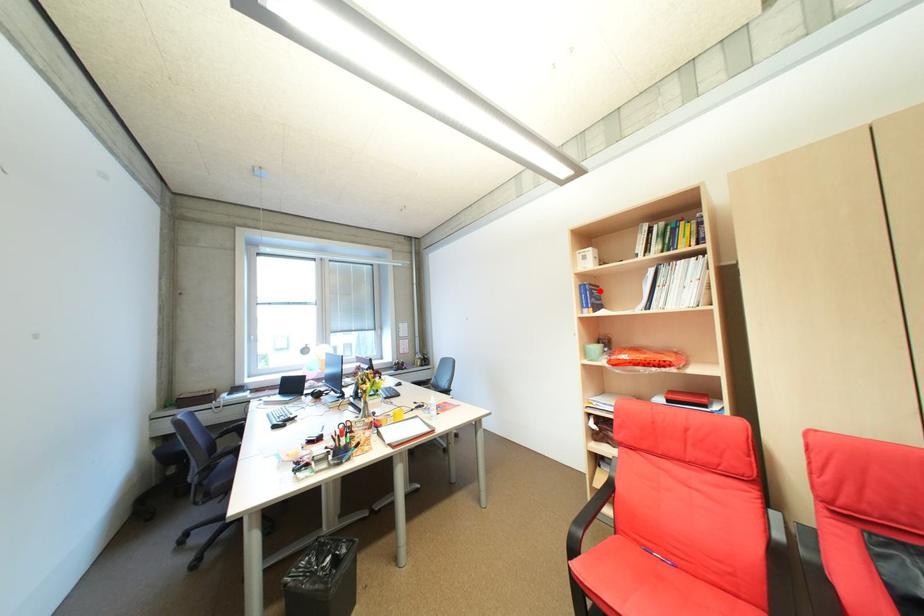
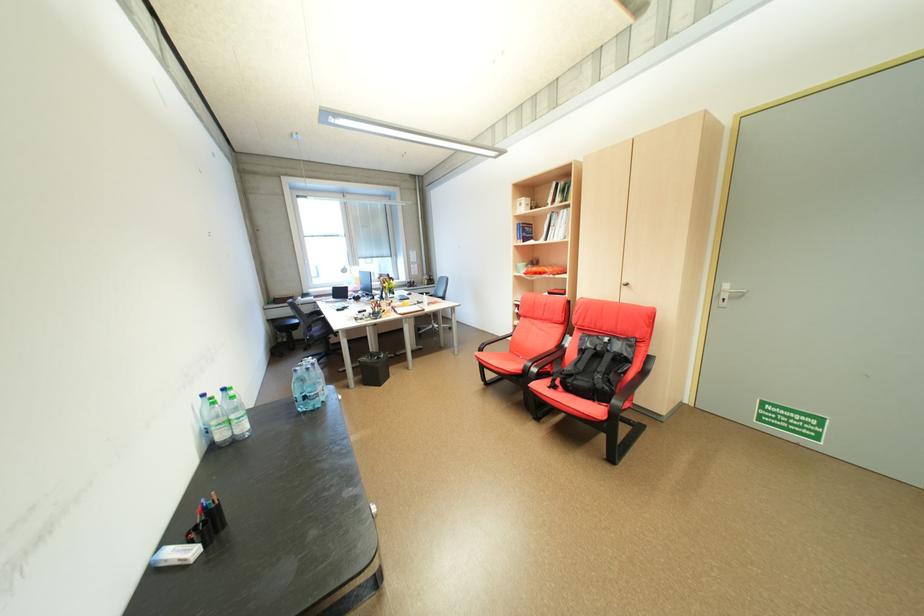
Where in the second image is the point corresponding to the highlighted location from the first image?

(532, 228)